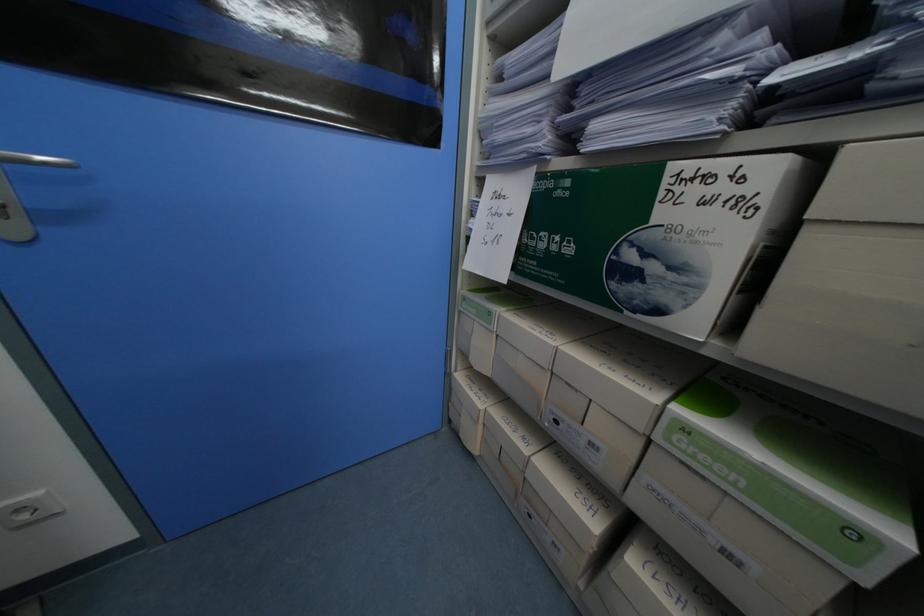
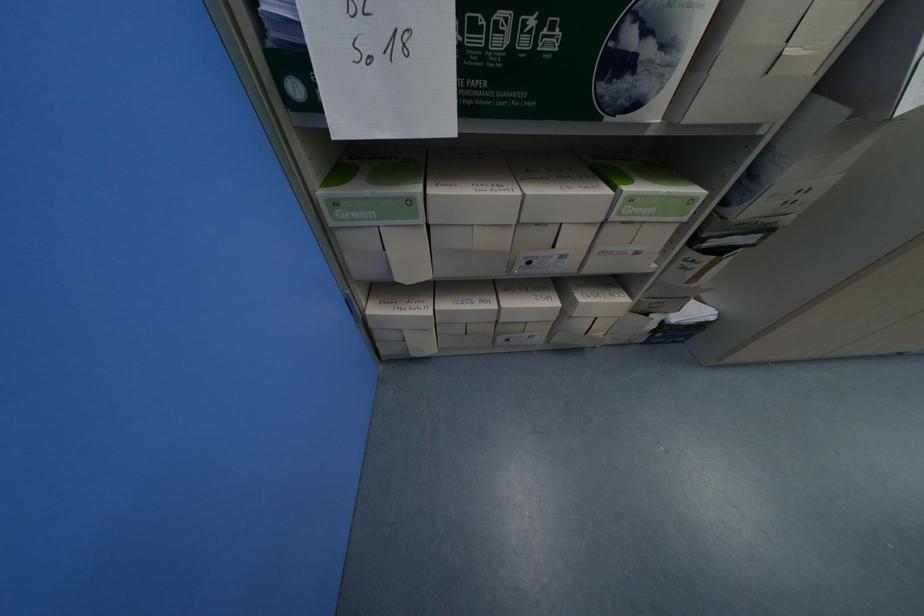
Where in the second image is the point corresponding to point (495, 314) from the first image?

(417, 203)